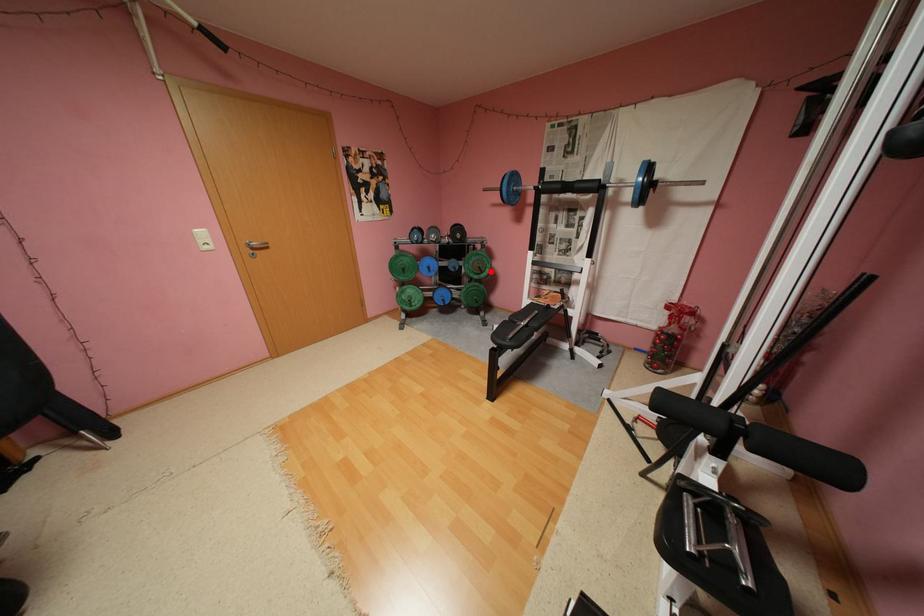
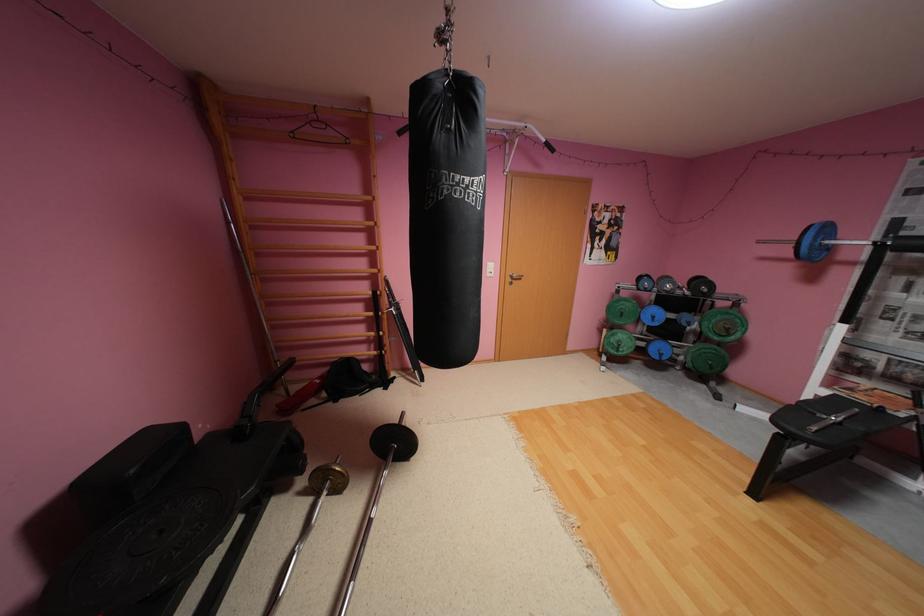
The point at the highlighted location is marked in the first image. Where is the corresponding point in the second image?

(737, 334)